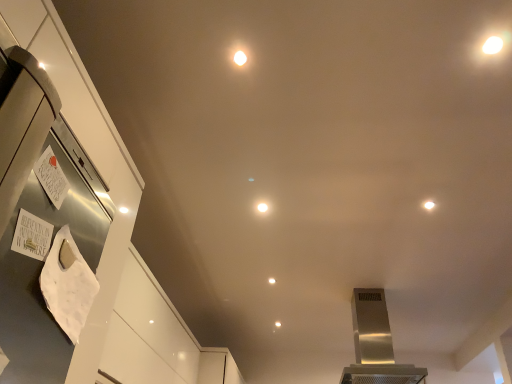
Question: Is white glossy light at center, the 2th light in the front-to-back sequence, taller or shorter than matte white light at center, the 1th light positioned from the back?

Choices:
 (A) tall
 (B) short

Answer: (B)

Question: Based on their sizes in the image, would you say white glossy light at center, the second light from the right, is bigger or smaller than matte white light at center, which is counted as the first light, starting from the bottom?

Choices:
 (A) big
 (B) small

Answer: (B)

Question: Which object is the farthest from the white glossy light at upper center, arranged as the 1th light when viewed from the front?

Choices:
 (A) matte white light at center, which appears as the third light when viewed from the front
 (B) white glossy light at center, placed as the 2th light when sorted from back to front
 (C) stainless steel range hood at center

Answer: (C)

Question: Which object is positioned farthest from the stainless steel range hood at center?

Choices:
 (A) white glossy light at center, placed as the 2th light when sorted from back to front
 (B) white glossy light at upper center, the third light positioned from the bottom
 (C) matte white light at center, which is counted as the first light, starting from the bottom

Answer: (B)